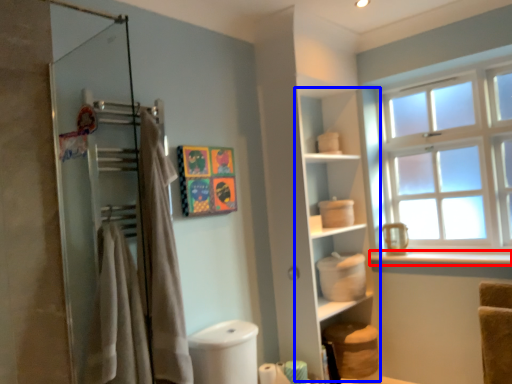
Question: Which object is closer to the camera taking this photo, window sill (highlighted by a red box) or cabinet (highlighted by a blue box)?

Choices:
 (A) window sill
 (B) cabinet

Answer: (A)